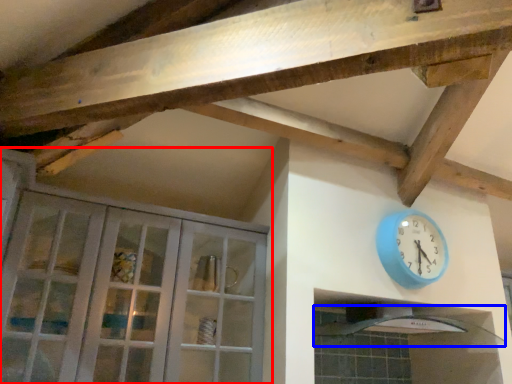
Question: Which point is further to the camera, cabinetry (highlighted by a red box) or exhaust hood (highlighted by a blue box)?

Choices:
 (A) cabinetry
 (B) exhaust hood

Answer: (B)